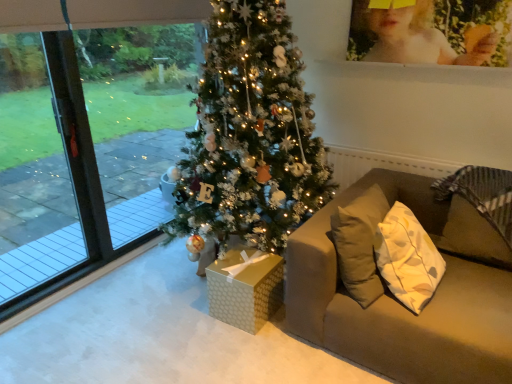
Where is `vacant position to the left of gold textured gift box at center`? vacant position to the left of gold textured gift box at center is located at coordinates (189, 312).